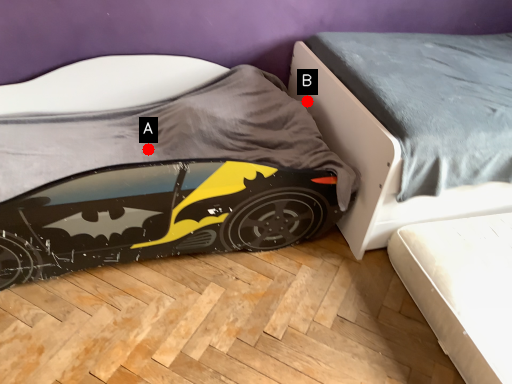
Question: Two points are circled on the image, labeled by A and B beside each circle. Which point is closer to the camera?

Choices:
 (A) A is closer
 (B) B is closer

Answer: (A)